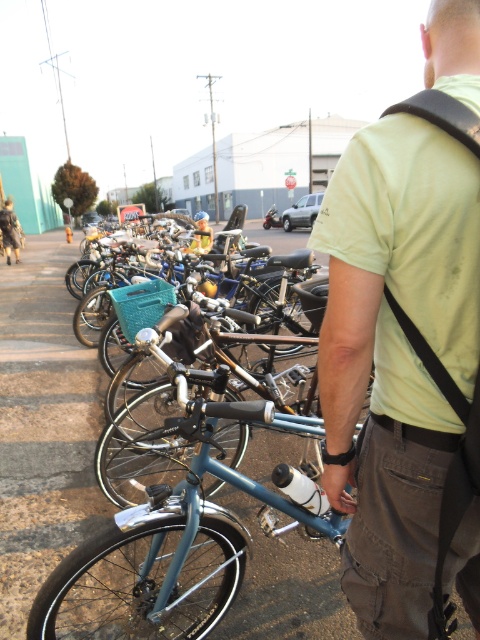
Question: Can you confirm if light green t-shirt at center is positioned to the left of matte plastic bicycle at center?

Choices:
 (A) no
 (B) yes

Answer: (A)

Question: Is brown leather jacket at upper left in front of matte plastic bicycle at center?

Choices:
 (A) no
 (B) yes

Answer: (A)

Question: Based on their relative distances, which object is nearer to the brown leather jacket at upper left?

Choices:
 (A) matte plastic bicycle at center
 (B) light green t-shirt at center

Answer: (A)

Question: Which point is closer to the camera?

Choices:
 (A) (210, 232)
 (B) (11, 204)

Answer: (A)

Question: Among these points, which one is nearest to the camera?

Choices:
 (A) (372, 416)
 (B) (12, 237)

Answer: (A)

Question: Is brown leather jacket at upper left in front of matte plastic bicycle at center?

Choices:
 (A) no
 (B) yes

Answer: (A)